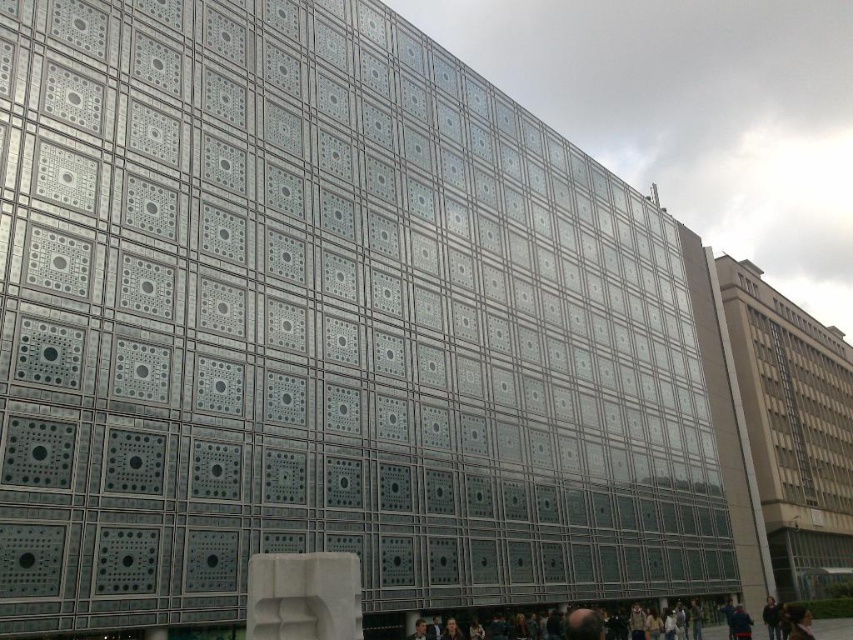
Question: Is dark blue uniform at lower right closer to camera compared to dark brown leather jacket at lower right?

Choices:
 (A) yes
 (B) no

Answer: (A)

Question: Does dark blue uniform at lower right have a smaller size compared to dark brown leather jacket at lower right?

Choices:
 (A) no
 (B) yes

Answer: (B)

Question: Does dark blue uniform at lower right come in front of dark brown leather jacket at lower right?

Choices:
 (A) yes
 (B) no

Answer: (A)

Question: Among these points, which one is farthest from the camera?

Choices:
 (A) tap(728, 621)
 (B) tap(416, 620)

Answer: (A)

Question: Which point is farther to the camera?

Choices:
 (A) (753, 620)
 (B) (750, 627)
 (C) (770, 602)

Answer: (A)

Question: Which object is farther from the camera taking this photo?

Choices:
 (A) dark brown leather jacket at lower right
 (B) dark brown leather jacket at lower center
 (C) dark blue uniform at lower right

Answer: (A)